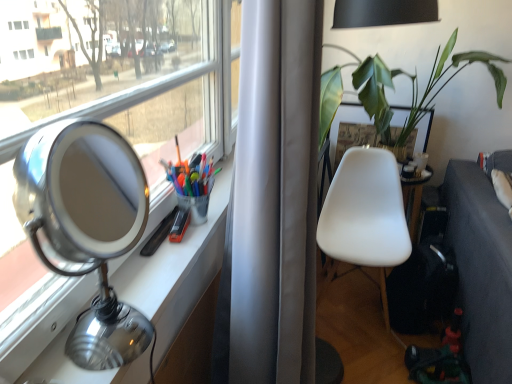
What is the approximate width of dark gray fabric couch at lower right?

dark gray fabric couch at lower right is 22.84 inches wide.

Identify the location of dark gray fabric couch at lower right. The image size is (512, 384). (481, 264).

Identify the location of green leafy plant at upper right. (410, 58).

Do you think green leafy plant at upper right is within white matte chair at center, or outside of it?

green leafy plant at upper right is not inside white matte chair at center, it's outside.

Between green leafy plant at upper right and white matte chair at center, which one has smaller size?

Smaller between the two is white matte chair at center.

Is the position of green leafy plant at upper right more distant than that of white matte chair at center?

No, green leafy plant at upper right is in front of white matte chair at center.

Does green leafy plant at upper right turn towards white matte chair at center?

No, green leafy plant at upper right is not facing towards white matte chair at center.

Is green leafy plant at upper right facing towards polished silver table lamp at left?

Yes, green leafy plant at upper right is oriented towards polished silver table lamp at left.

In the scene shown: Is green leafy plant at upper right thinner than polished silver table lamp at left?

No, green leafy plant at upper right is not thinner than polished silver table lamp at left.

Can you confirm if green leafy plant at upper right is smaller than polished silver table lamp at left?

Actually, green leafy plant at upper right might be larger than polished silver table lamp at left.

Based on the photo, which object is positioned more to the left, green leafy plant at upper right or polished silver table lamp at left?

Positioned to the left is polished silver table lamp at left.

Considering the sizes of objects green leafy plant at upper right and dark gray fabric couch at lower right in the image provided, who is thinner, green leafy plant at upper right or dark gray fabric couch at lower right?

dark gray fabric couch at lower right.

How different are the orientations of green leafy plant at upper right and dark gray fabric couch at lower right in degrees?

They differ by 89.3 degrees in their facing directions.

From the image's perspective, is green leafy plant at upper right beneath dark gray fabric couch at lower right?

Actually, green leafy plant at upper right appears above dark gray fabric couch at lower right in the image.

Considering the positions of objects green leafy plant at upper right and dark gray fabric couch at lower right in the image provided, who is behind, green leafy plant at upper right or dark gray fabric couch at lower right?

green leafy plant at upper right is further from the camera.

Consider the image. Is polished silver table lamp at left to the right of dark gray fabric couch at lower right from the viewer's perspective?

Incorrect, polished silver table lamp at left is not on the right side of dark gray fabric couch at lower right.

From a real-world perspective, is polished silver table lamp at left located beneath dark gray fabric couch at lower right?

No.

Is polished silver table lamp at left looking in the opposite direction of dark gray fabric couch at lower right?

No, polished silver table lamp at left is not facing away from dark gray fabric couch at lower right.

Considering the sizes of objects polished silver table lamp at left and dark gray fabric couch at lower right in the image provided, who is smaller, polished silver table lamp at left or dark gray fabric couch at lower right?

polished silver table lamp at left is smaller.

How many degrees apart are the facing directions of white matte chair at center and dark gray fabric couch at lower right?

They differ by 89.2 degrees in their facing directions.

From a real-world perspective, which is physically above, white matte chair at center or dark gray fabric couch at lower right?

white matte chair at center.

Is white matte chair at center positioned with its back to dark gray fabric couch at lower right?

No, white matte chair at center's orientation is not away from dark gray fabric couch at lower right.

Considering the sizes of objects white matte chair at center and dark gray fabric couch at lower right in the image provided, who is thinner, white matte chair at center or dark gray fabric couch at lower right?

white matte chair at center.

Can you tell me how much white matte chair at center and green leafy plant at upper right differ in facing direction?

They differ by 0.0887 degrees in their facing directions.

Considering the relative sizes of white matte chair at center and green leafy plant at upper right in the image provided, is white matte chair at center wider than green leafy plant at upper right?

In fact, white matte chair at center might be narrower than green leafy plant at upper right.

From a real-world perspective, which is physically below, white matte chair at center or green leafy plant at upper right?

white matte chair at center, from a real-world perspective.

Considering the sizes of objects white matte chair at center and green leafy plant at upper right in the image provided, who is shorter, white matte chair at center or green leafy plant at upper right?

green leafy plant at upper right is shorter.

Identify the location of houseplant located behind the polished silver table lamp at left. (410, 58).

How much distance is there between polished silver table lamp at left and green leafy plant at upper right?

polished silver table lamp at left is 6.97 feet away from green leafy plant at upper right.

Can you confirm if polished silver table lamp at left is thinner than green leafy plant at upper right?

Correct, the width of polished silver table lamp at left is less than that of green leafy plant at upper right.

From the image's perspective, does polished silver table lamp at left appear higher than green leafy plant at upper right?

Actually, polished silver table lamp at left appears below green leafy plant at upper right in the image.

The height and width of the screenshot is (384, 512). I want to click on houseplant in front of the white matte chair at center, so click(410, 58).

Identify the location of houseplant on the right of polished silver table lamp at left. (410, 58).

Looking at the image, which one is located further to green leafy plant at upper right, polished silver table lamp at left or dark gray fabric couch at lower right?

The object further to green leafy plant at upper right is polished silver table lamp at left.

Estimate the real-world distances between objects in this image. Which object is further from dark gray fabric couch at lower right, white matte chair at center or polished silver table lamp at left?

polished silver table lamp at left is further to dark gray fabric couch at lower right.

Looking at the image, which one is located further to dark gray fabric couch at lower right, green leafy plant at upper right or polished silver table lamp at left?

Based on the image, polished silver table lamp at left appears to be further to dark gray fabric couch at lower right.

Looking at this image, looking at the image, which one is located further to green leafy plant at upper right, white matte chair at center or dark gray fabric couch at lower right?

dark gray fabric couch at lower right is further to green leafy plant at upper right.

Which object lies nearer to the anchor point white matte chair at center, polished silver table lamp at left or dark gray fabric couch at lower right?

Based on the image, dark gray fabric couch at lower right appears to be nearer to white matte chair at center.

Which object lies further to the anchor point white matte chair at center, dark gray fabric couch at lower right or polished silver table lamp at left?

polished silver table lamp at left.

Based on their spatial positions, is polished silver table lamp at left or green leafy plant at upper right closer to dark gray fabric couch at lower right?

green leafy plant at upper right.

Estimate the real-world distances between objects in this image. Which object is closer to white matte chair at center, green leafy plant at upper right or polished silver table lamp at left?

green leafy plant at upper right lies closer to white matte chair at center than the other object.

The image size is (512, 384). In order to click on houseplant positioned between polished silver table lamp at left and white matte chair at center from near to far in this screenshot , I will do `click(410, 58)`.

I want to click on houseplant situated between polished silver table lamp at left and dark gray fabric couch at lower right from left to right, so click(x=410, y=58).

Where is `chair between green leafy plant at upper right and dark gray fabric couch at lower right from top to bottom`? The image size is (512, 384). chair between green leafy plant at upper right and dark gray fabric couch at lower right from top to bottom is located at coordinates (366, 215).

The width and height of the screenshot is (512, 384). In order to click on chair between polished silver table lamp at left and dark gray fabric couch at lower right in the horizontal direction in this screenshot , I will do `click(366, 215)`.